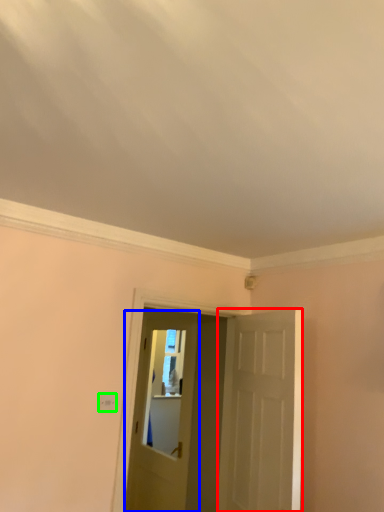
Question: Estimate the real-world distances between objects in this image. Which object is farther from door (highlighted by a red box), door (highlighted by a blue box) or light switch (highlighted by a green box)?

Choices:
 (A) door
 (B) light switch

Answer: (A)